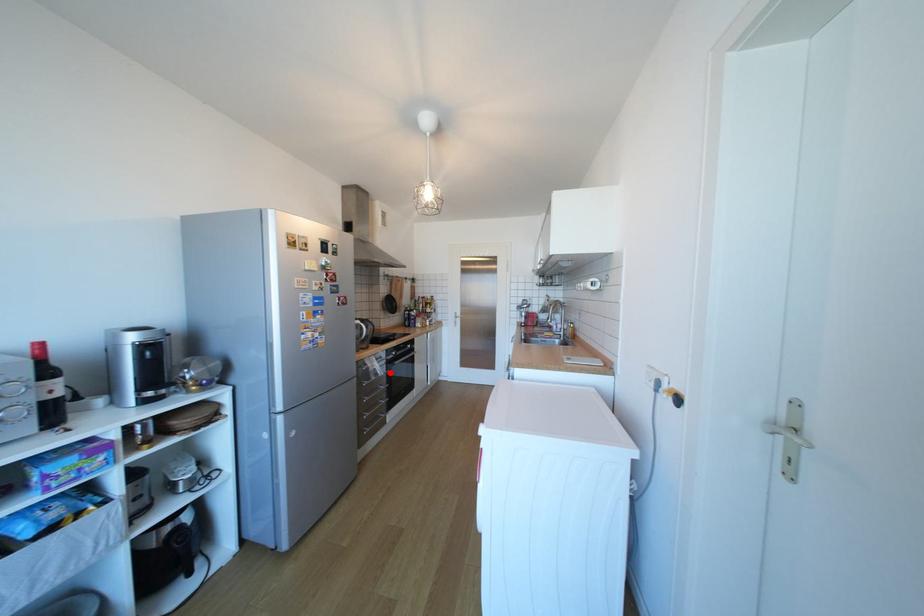
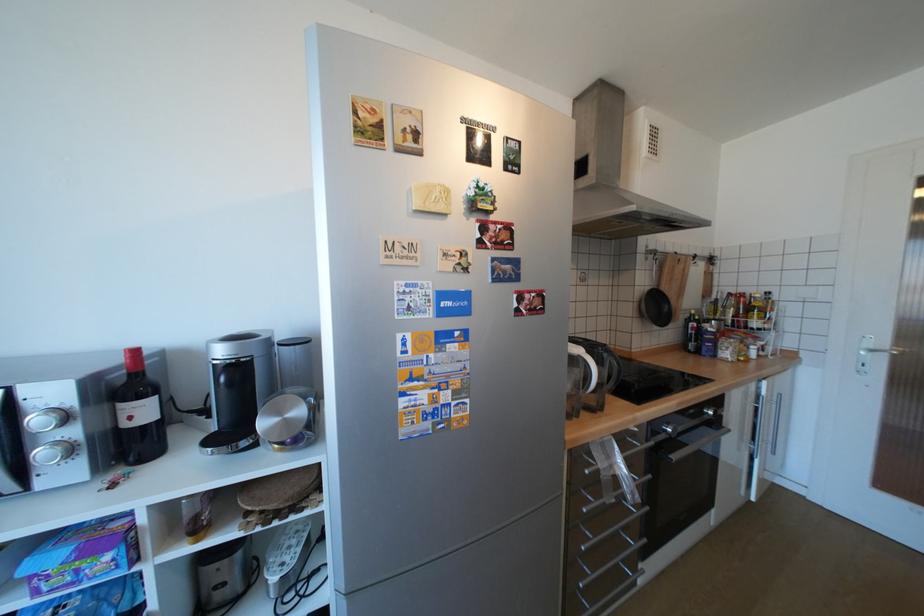
Question: A red point is marked in image1. In image2, is the corresponding 3D point closer to the camera or farther? Reply with the corresponding letter.

Choices:
 (A) The corresponding 3D point is closer.
 (B) The corresponding 3D point is farther.

Answer: (B)